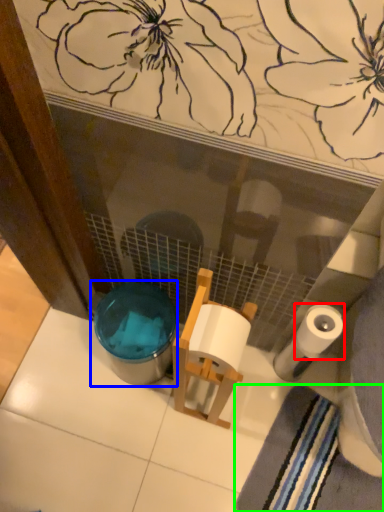
Question: Estimate the real-world distances between objects in this image. Which object is farther from toilet paper (highlighted by a red box), potty (highlighted by a blue box) or bath towel (highlighted by a green box)?

Choices:
 (A) potty
 (B) bath towel

Answer: (A)